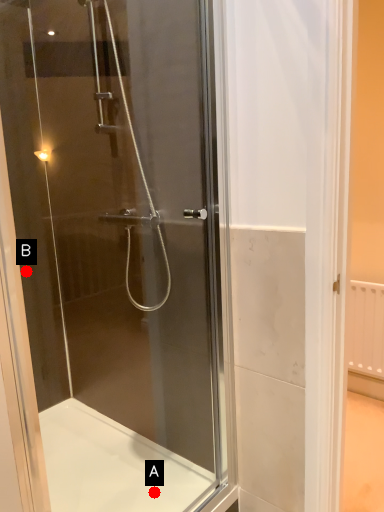
Question: Two points are circled on the image, labeled by A and B beside each circle. Among these points, which one is farthest from the camera?

Choices:
 (A) A is further
 (B) B is further

Answer: (B)